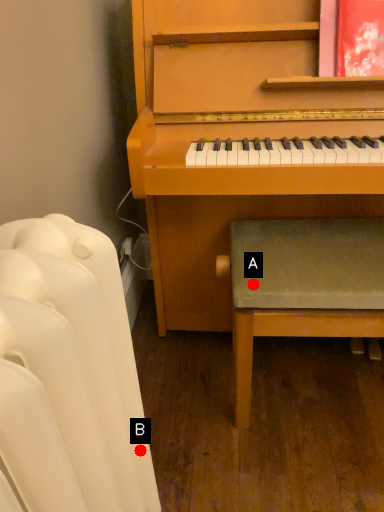
Question: Two points are circled on the image, labeled by A and B beside each circle. Which point is closer to the camera taking this photo?

Choices:
 (A) A is closer
 (B) B is closer

Answer: (B)